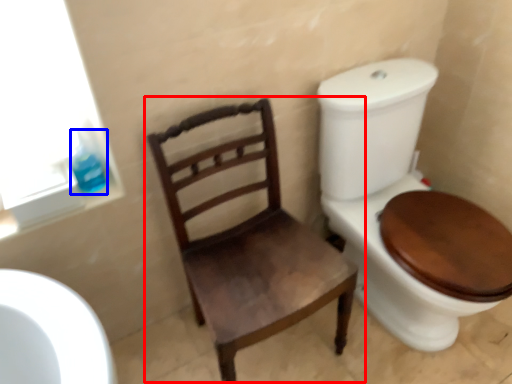
Question: Among these objects, which one is nearest to the camera, chair (highlighted by a red box) or toilet paper (highlighted by a blue box)?

Choices:
 (A) chair
 (B) toilet paper

Answer: (A)